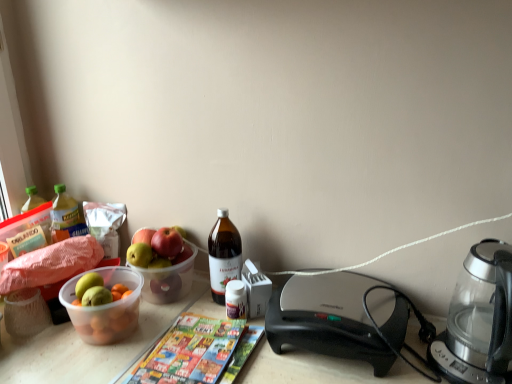
Question: Is translucent glass bottle at center, positioned as the 2th bottle in left-to-right order, turned away from black plastic sandwich maker at center?

Choices:
 (A) no
 (B) yes

Answer: (A)

Question: Is translucent glass bottle at center, the second bottle positioned from the back, next to black plastic sandwich maker at center?

Choices:
 (A) no
 (B) yes

Answer: (A)

Question: Considering the relative sizes of translucent glass bottle at center, positioned as the 2th bottle in left-to-right order, and black plastic sandwich maker at center in the image provided, is translucent glass bottle at center, positioned as the 2th bottle in left-to-right order, shorter than black plastic sandwich maker at center?

Choices:
 (A) no
 (B) yes

Answer: (A)

Question: Would you say translucent glass bottle at center, which is the first bottle in right-to-left order, contains black plastic sandwich maker at center?

Choices:
 (A) yes
 (B) no

Answer: (B)

Question: From the image's perspective, is translucent glass bottle at center, which is the first bottle in right-to-left order, over black plastic sandwich maker at center?

Choices:
 (A) yes
 (B) no

Answer: (A)

Question: Is the depth of translucent glass bottle at center, the first bottle viewed from the front, greater than that of black plastic sandwich maker at center?

Choices:
 (A) yes
 (B) no

Answer: (A)

Question: Does translucent plastic bowl at left touch transparent glass coffee maker at right?

Choices:
 (A) no
 (B) yes

Answer: (A)

Question: Is translucent plastic bowl at left positioned beyond the bounds of transparent glass coffee maker at right?

Choices:
 (A) yes
 (B) no

Answer: (A)

Question: From a real-world perspective, is translucent plastic bowl at left over transparent glass coffee maker at right?

Choices:
 (A) no
 (B) yes

Answer: (A)

Question: Considering the relative sizes of translucent plastic bowl at left and transparent glass coffee maker at right in the image provided, is translucent plastic bowl at left shorter than transparent glass coffee maker at right?

Choices:
 (A) yes
 (B) no

Answer: (A)

Question: Can you confirm if translucent plastic bowl at left is taller than transparent glass coffee maker at right?

Choices:
 (A) yes
 (B) no

Answer: (B)

Question: From a real-world perspective, does translucent plastic bowl at left sit lower than transparent glass coffee maker at right?

Choices:
 (A) no
 (B) yes

Answer: (B)

Question: Is translucent glass bottle at center, positioned as the 2th bottle in left-to-right order, inside translucent plastic bottle at left, positioned as the 1th bottle in left-to-right order?

Choices:
 (A) yes
 (B) no

Answer: (B)